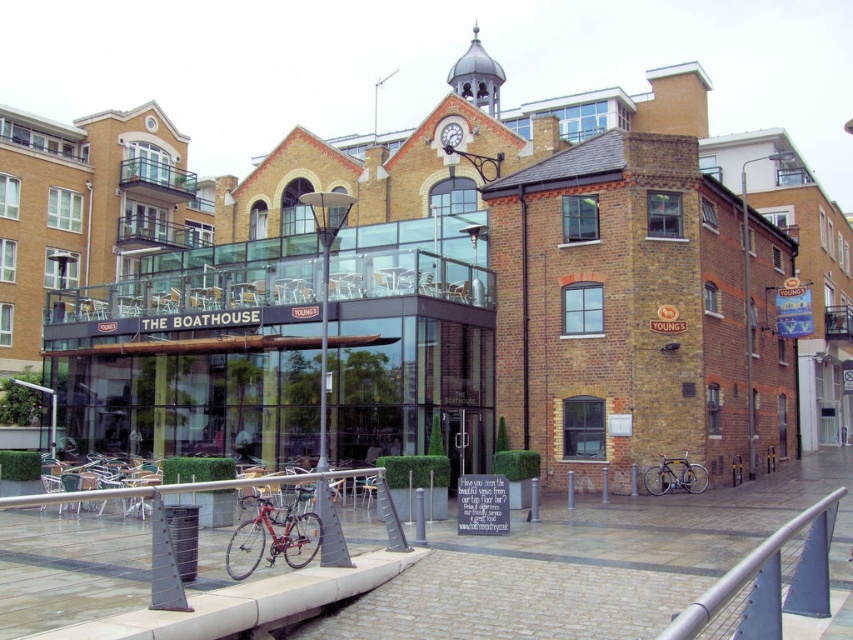
Question: Among these points, which one is nearest to the camera?

Choices:
 (A) (344, 474)
 (B) (695, 628)

Answer: (B)

Question: Does shiny red bicycle at lower left come in front of brushed metal rail at lower center?

Choices:
 (A) no
 (B) yes

Answer: (A)

Question: Which of the following is the farthest from the observer?

Choices:
 (A) (256, 540)
 (B) (164, 486)
 (C) (683, 621)

Answer: (A)

Question: Is polished metal railing at lower right to the left of brushed metal rail at lower center from the viewer's perspective?

Choices:
 (A) yes
 (B) no

Answer: (B)

Question: Is polished metal railing at lower right to the left of brushed metal rail at lower center from the viewer's perspective?

Choices:
 (A) yes
 (B) no

Answer: (B)

Question: Which point is farther to the camera?

Choices:
 (A) pyautogui.click(x=660, y=480)
 (B) pyautogui.click(x=259, y=540)
 (C) pyautogui.click(x=102, y=492)

Answer: (A)